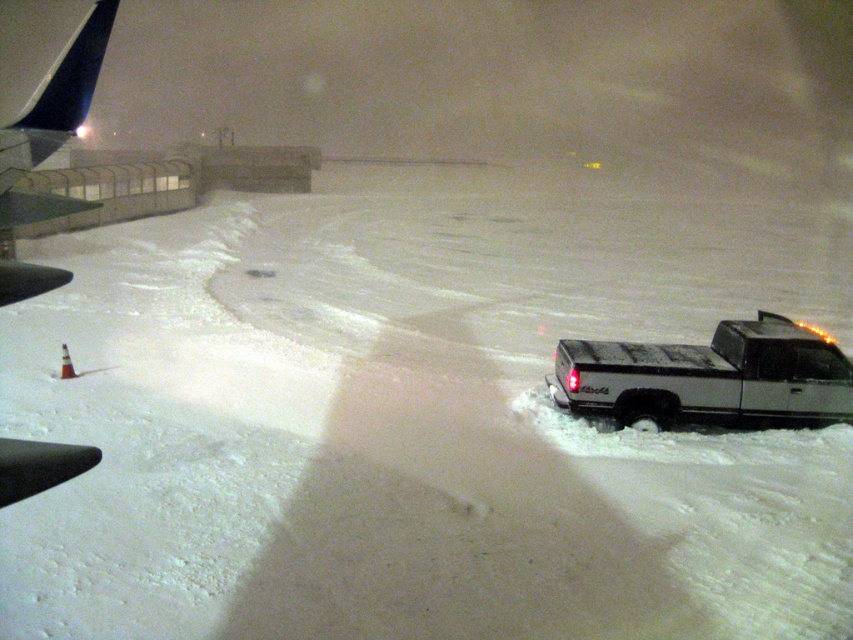
Question: Can you confirm if silver metallic truck at right is positioned to the left of dark blue metallic airplane wing at upper left?

Choices:
 (A) yes
 (B) no

Answer: (B)

Question: Among these points, which one is farthest from the camera?

Choices:
 (A) (68, 356)
 (B) (53, 198)

Answer: (A)

Question: From the image, what is the correct spatial relationship of dark blue metallic airplane wing at upper left in relation to white plastic cone at lower left?

Choices:
 (A) below
 (B) above

Answer: (B)

Question: Which point is farther from the camera taking this photo?

Choices:
 (A) (576, 376)
 (B) (68, 376)

Answer: (B)

Question: Which object is positioned closest to the white plastic cone at lower left?

Choices:
 (A) dark blue metallic airplane wing at upper left
 (B) silver metallic truck at right

Answer: (B)

Question: Is silver metallic truck at right wider than dark blue metallic airplane wing at upper left?

Choices:
 (A) yes
 (B) no

Answer: (B)